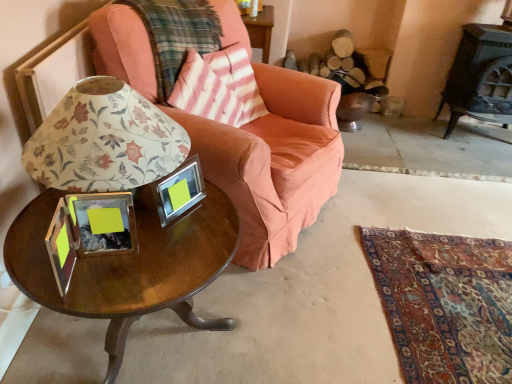
Identify the location of vacant area that lies to the right of matte pink fabric chair at center. (403, 236).